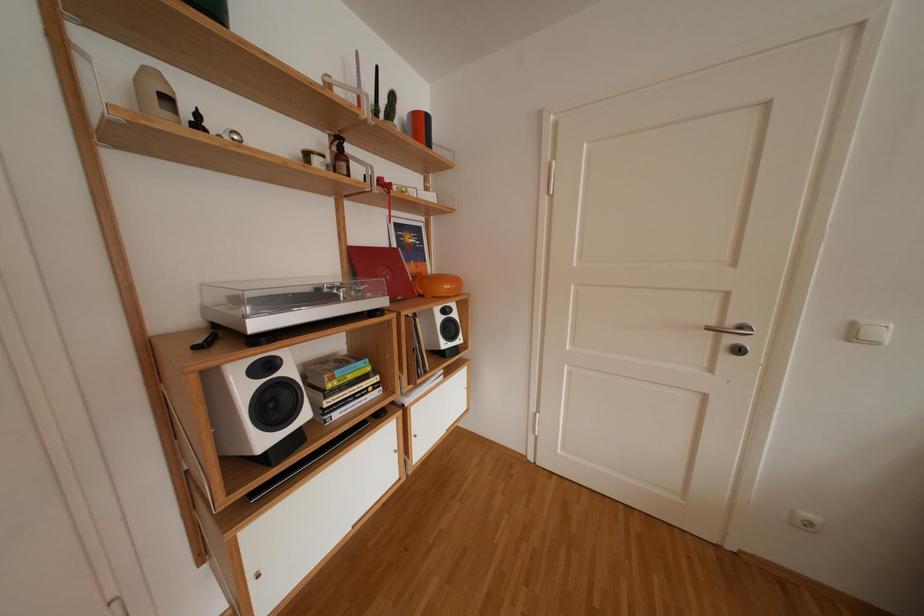
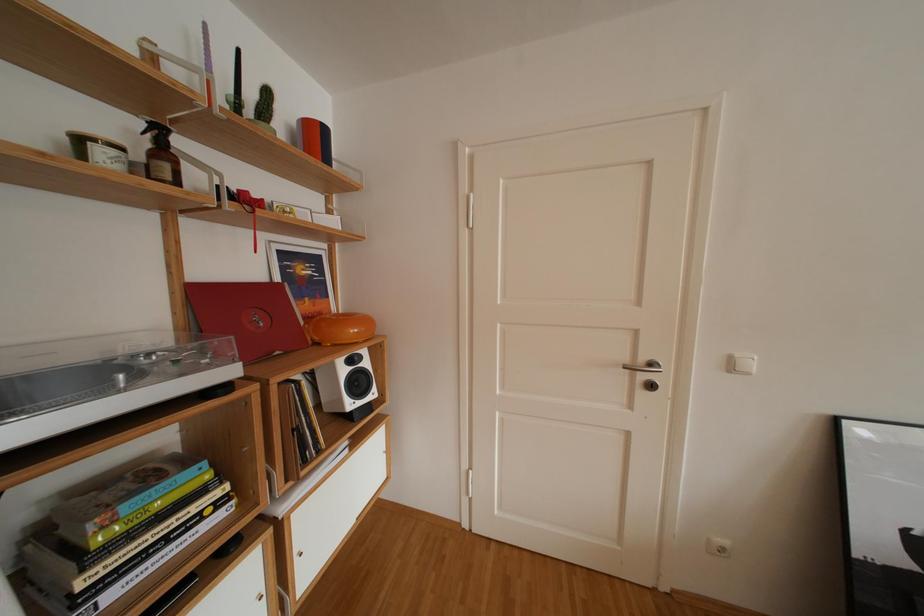
Question: The camera is either moving clockwise (left) or counter-clockwise (right) around the object. The first image is from the beginning of the video and the second image is from the end. Is the camera moving left or right when shooting the video?

Choices:
 (A) Left
 (B) Right

Answer: (A)